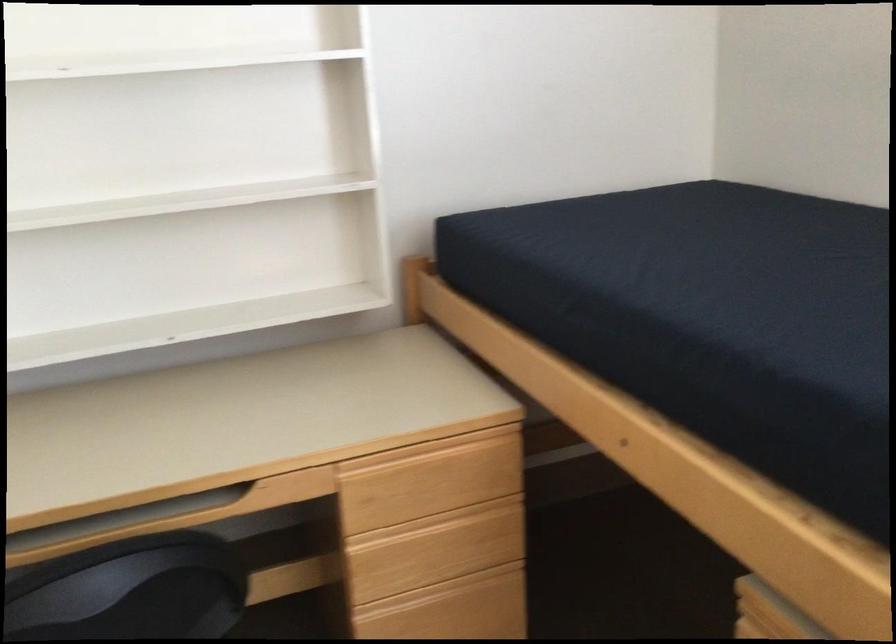
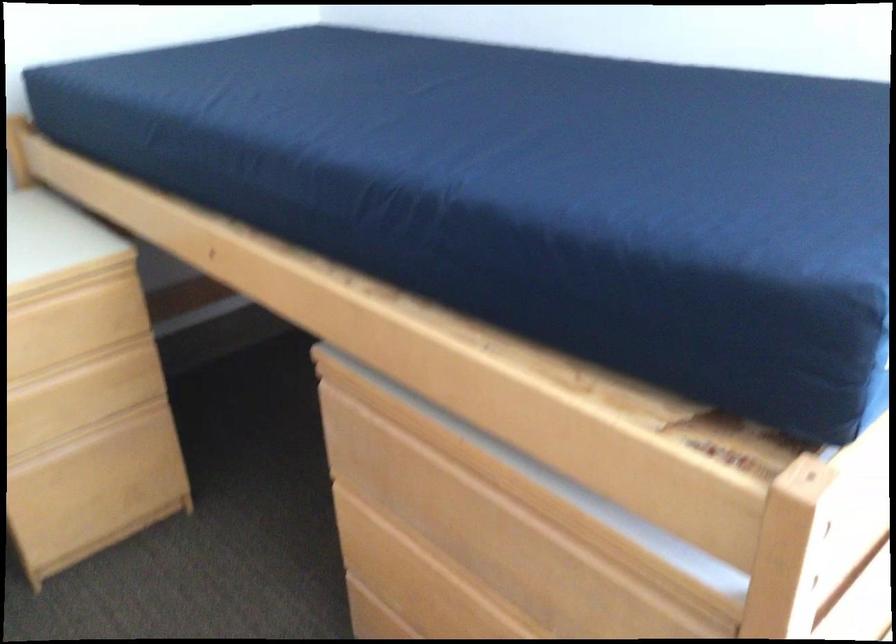
In the second image, find the point that corresponds to pixel 452 471 in the first image.

(73, 323)